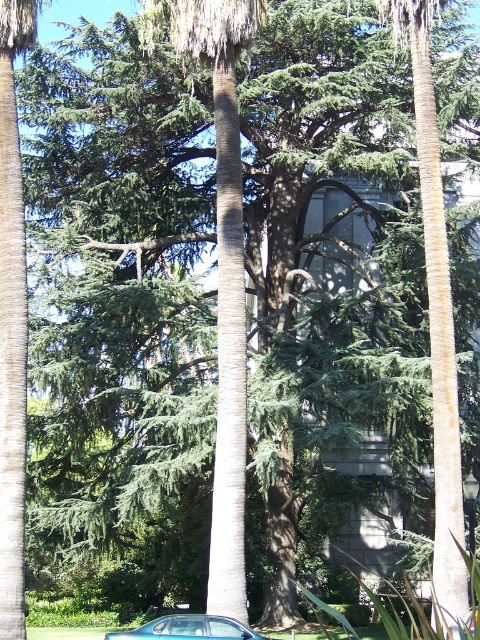
The image size is (480, 640). What do you see at coordinates (222, 268) in the screenshot?
I see `brown textured palm tree at center` at bounding box center [222, 268].

Consider the image. Can you confirm if brown textured palm tree at center is positioned to the right of smooth brown palm tree at center?

In fact, brown textured palm tree at center is to the left of smooth brown palm tree at center.

This screenshot has width=480, height=640. What do you see at coordinates (222, 268) in the screenshot?
I see `brown textured palm tree at center` at bounding box center [222, 268].

Where is `brown textured palm tree at center`? Image resolution: width=480 pixels, height=640 pixels. brown textured palm tree at center is located at coordinates (222, 268).

Does smooth brown palm tree at center come in front of metallic silver car at lower center?

Yes, smooth brown palm tree at center is in front of metallic silver car at lower center.

Who is higher up, smooth brown palm tree at center or metallic silver car at lower center?

smooth brown palm tree at center is higher up.

You are a GUI agent. You are given a task and a screenshot of the screen. Output one action in this format:
    pyautogui.click(x=<x>, y=<y>)
    Task: Click on the smooth brown palm tree at center
    Image resolution: width=480 pixels, height=640 pixels.
    Given the screenshot: What is the action you would take?
    pyautogui.click(x=435, y=316)

Where is `smooth brown palm tree at center`? This screenshot has width=480, height=640. smooth brown palm tree at center is located at coordinates (435, 316).

Can you confirm if brown textured palm tree at center is smaller than metallic silver car at lower center?

No, brown textured palm tree at center is not smaller than metallic silver car at lower center.

Does brown textured palm tree at center have a larger size compared to metallic silver car at lower center?

Indeed, brown textured palm tree at center has a larger size compared to metallic silver car at lower center.

Is point (240, 378) more distant than point (216, 616)?

Yes.

Where is `brown textured palm tree at center`? Image resolution: width=480 pixels, height=640 pixels. brown textured palm tree at center is located at coordinates (222, 268).